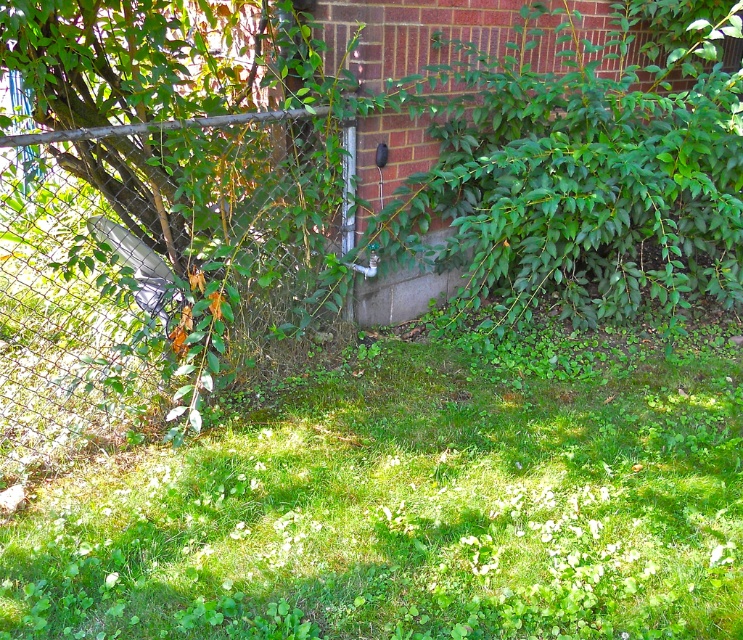
You are standing in the backyard and want to place a small potted plant exactly at the center of the green grass at lower center. According to the image, what are the coordinates where you should place the potted plant?

A: The coordinates for the center of the green grass at lower center are at point (406, 513), so you should place the potted plant there.